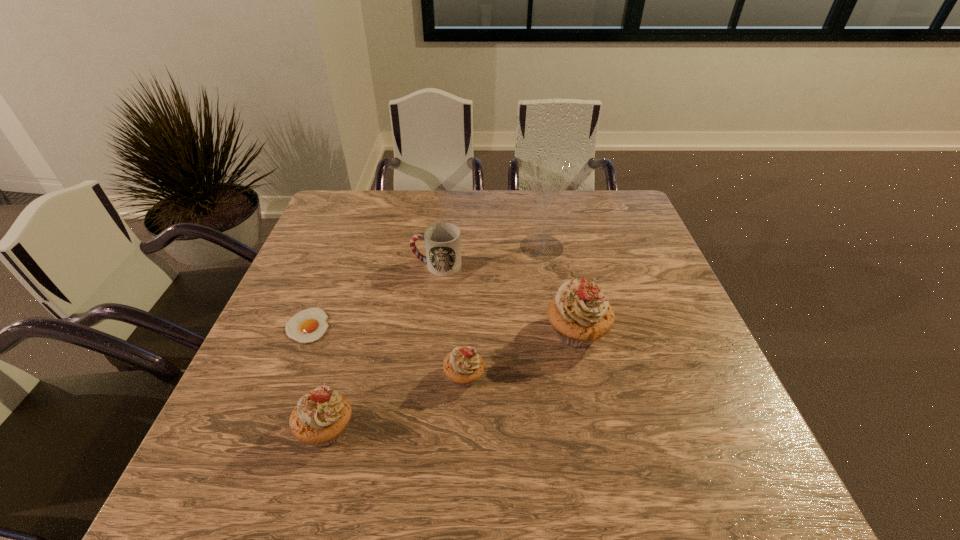
At what (x,y) coordinates should I click in order to perform the action: click on free spot located 0.200m on the right of the leftmost cupcake. Please return your answer as a coordinate pair (x, y). This screenshot has height=540, width=960. Looking at the image, I should click on (459, 429).

Where is `vacant space situated 0.060m on the back of the second cupcake from right to left`? The width and height of the screenshot is (960, 540). vacant space situated 0.060m on the back of the second cupcake from right to left is located at coordinates (x=466, y=340).

Locate an element on the screen. blank space located 0.200m on the left of the rightmost cupcake is located at coordinates (460, 333).

Locate an element on the screen. vacant region located on the handle side of the cup is located at coordinates (370, 265).

At what (x,y) coordinates should I click in order to perform the action: click on vacant space situated on the handle side of the cup. Please return your answer as a coordinate pair (x, y). This screenshot has width=960, height=540. Looking at the image, I should click on (387, 265).

Locate an element on the screen. This screenshot has width=960, height=540. vacant space located 0.320m on the handle side of the cup is located at coordinates (297, 265).

Locate an element on the screen. This screenshot has width=960, height=540. vacant region located on the back of the shortest object is located at coordinates (332, 265).

Locate an element on the screen. free space located on the front of the flute glass is located at coordinates (557, 333).

I want to click on object situated at the near edge, so click(320, 417).

Image resolution: width=960 pixels, height=540 pixels. In order to click on cupcake that is positioned at the left edge in this screenshot , I will do [320, 417].